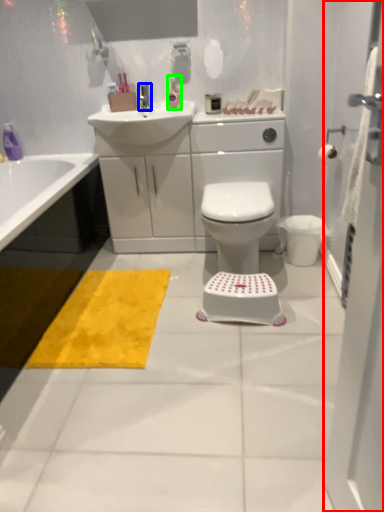
Question: Estimate the real-world distances between objects in this image. Which object is closer to screen door (highlighted by a red box), tap (highlighted by a blue box) or toiletry (highlighted by a green box)?

Choices:
 (A) tap
 (B) toiletry

Answer: (B)